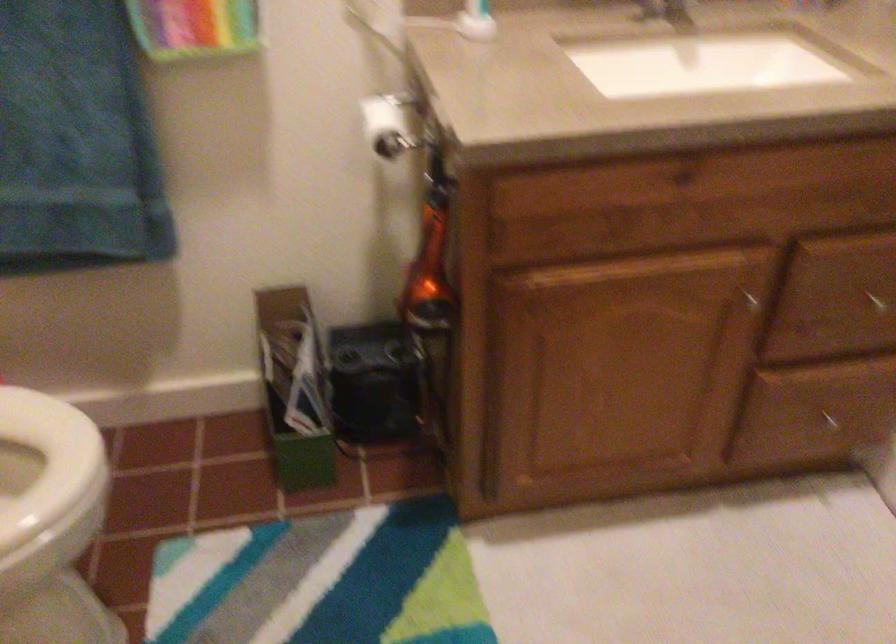
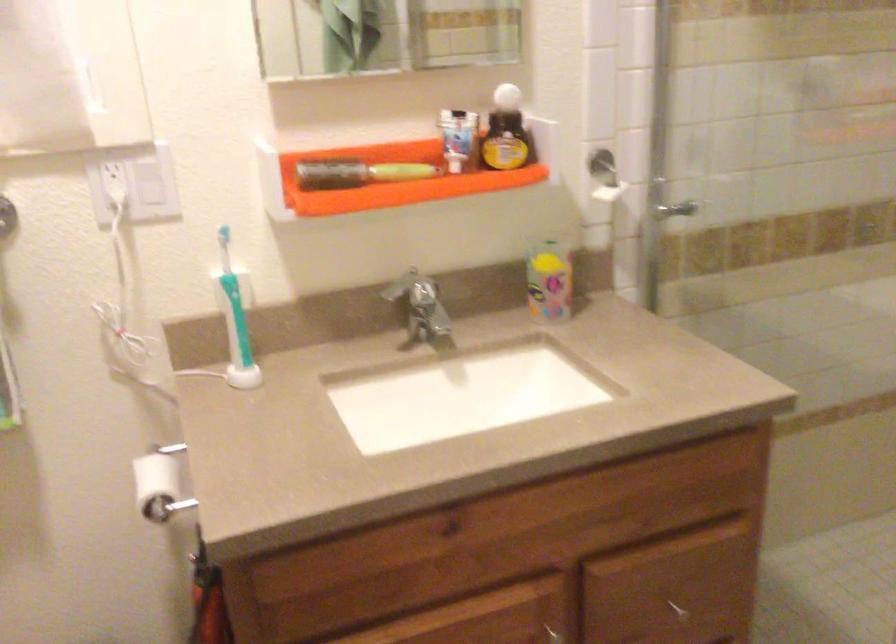
Question: How did the camera likely rotate?

Choices:
 (A) Left
 (B) Right
 (C) Up
 (D) Down

Answer: (C)